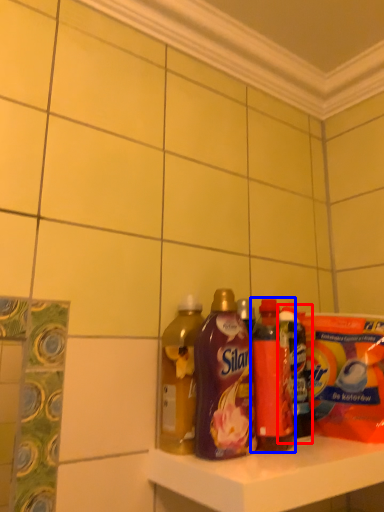
Question: Which object appears closest to the camera in this image, bottle (highlighted by a red box) or bottle (highlighted by a blue box)?

Choices:
 (A) bottle
 (B) bottle

Answer: (B)